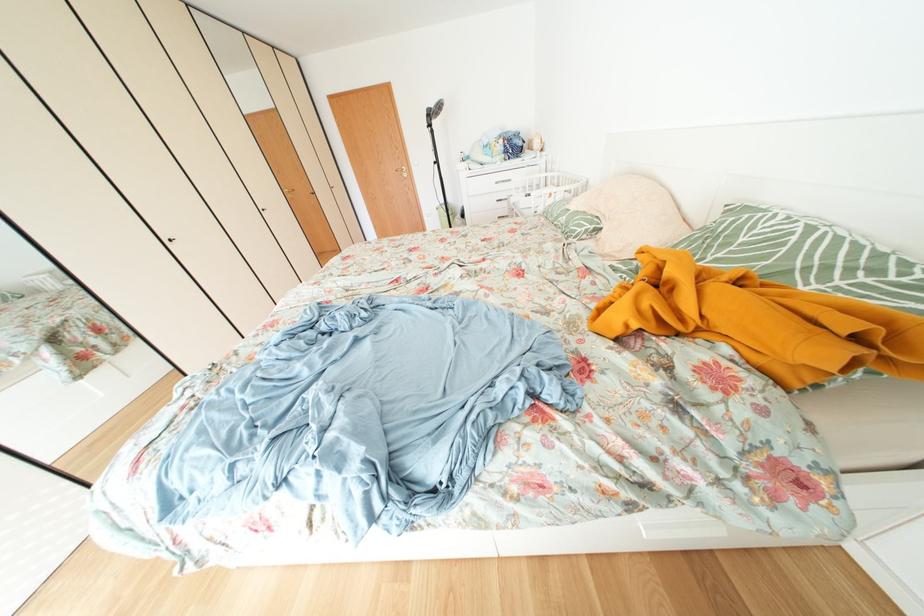
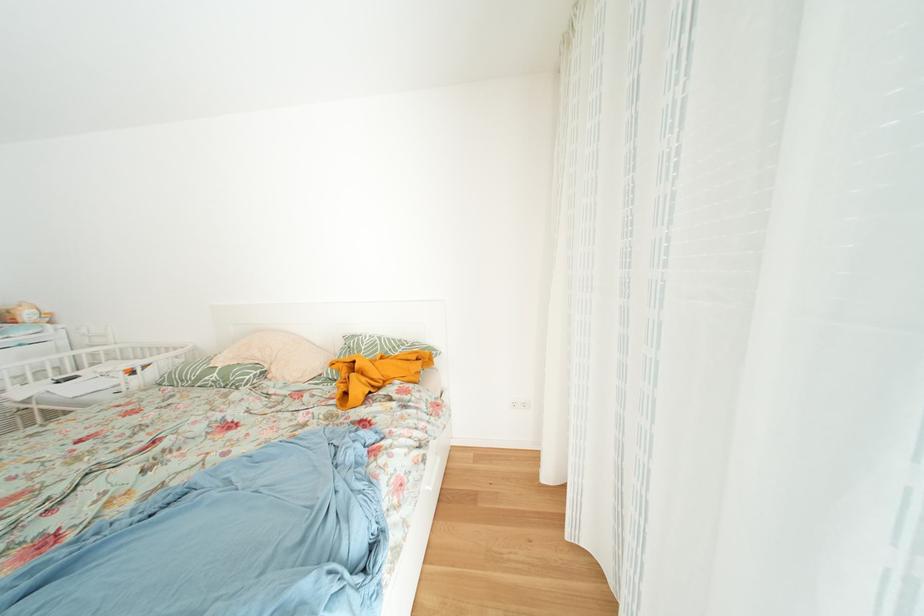
Question: The first image is from the beginning of the video and the second image is from the end. How did the camera likely rotate when shooting the video?

Choices:
 (A) Left
 (B) Right
 (C) Up
 (D) Down

Answer: (B)